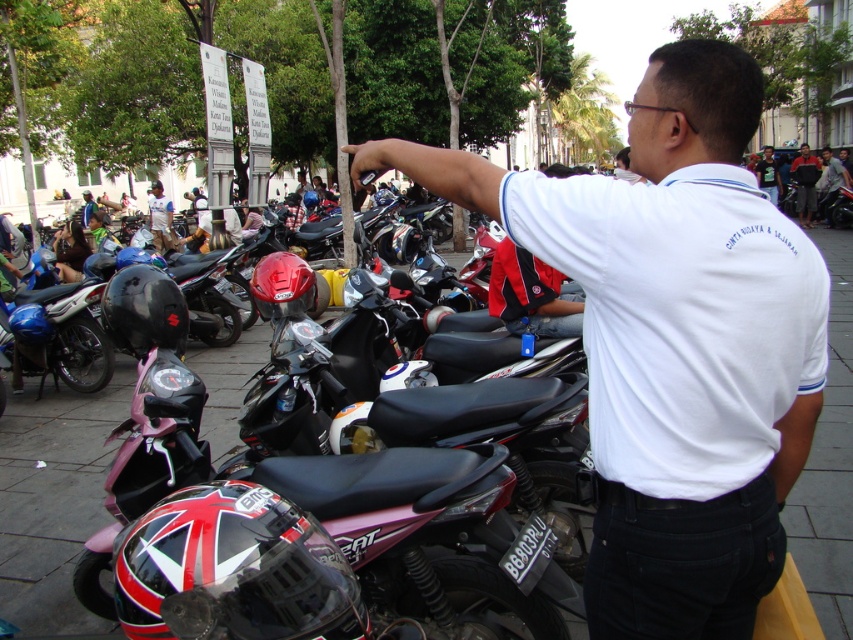
Question: Which object is the closest to the light gray fabric shirt at center?

Choices:
 (A) white smooth shirt at center
 (B) white shirt at upper center

Answer: (B)

Question: Does reddish-brown leather jacket at upper right appear on the left side of light gray fabric shirt at center?

Choices:
 (A) yes
 (B) no

Answer: (A)

Question: Is light gray fabric shirt at center below white shirt at upper center?

Choices:
 (A) yes
 (B) no

Answer: (A)

Question: Which point is farther to the camera?

Choices:
 (A) white smooth shirt at center
 (B) reddish-brown leather jacket at upper right

Answer: (B)

Question: Which point is closer to the camera taking this photo?

Choices:
 (A) (757, 163)
 (B) (724, 72)

Answer: (B)

Question: Considering the relative positions of white smooth shirt at center and light gray fabric shirt at center in the image provided, where is white smooth shirt at center located with respect to light gray fabric shirt at center?

Choices:
 (A) below
 (B) above

Answer: (A)